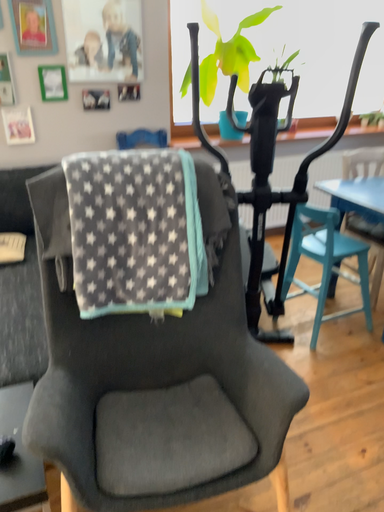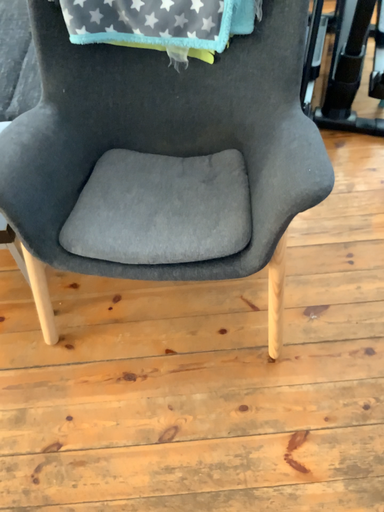
Question: Which way did the camera rotate in the video?

Choices:
 (A) rotated upward
 (B) rotated downward

Answer: (B)